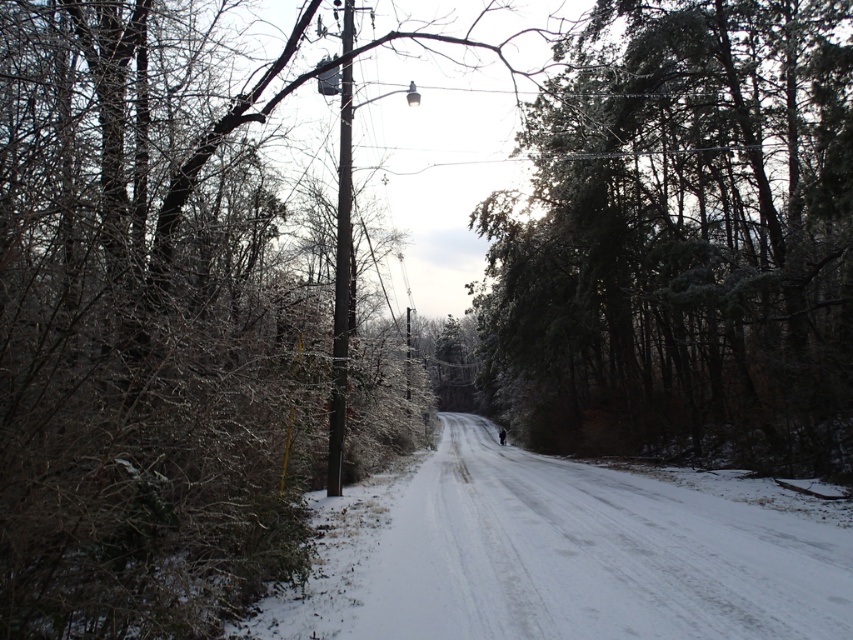
Is point (656, 316) more distant than point (343, 312)?

That is True.

Identify the location of green textured tree at center. This screenshot has height=640, width=853. (683, 241).